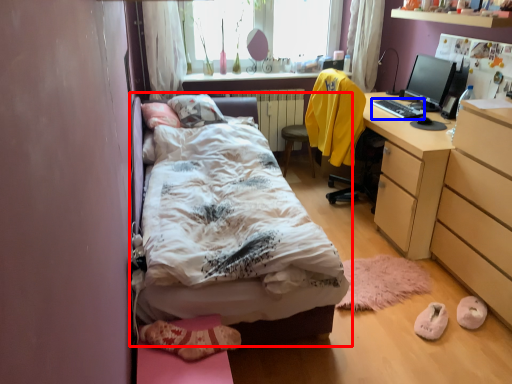
Question: Which point is closer to the camera, bed (highlighted by a red box) or desktop (highlighted by a blue box)?

Choices:
 (A) bed
 (B) desktop

Answer: (A)